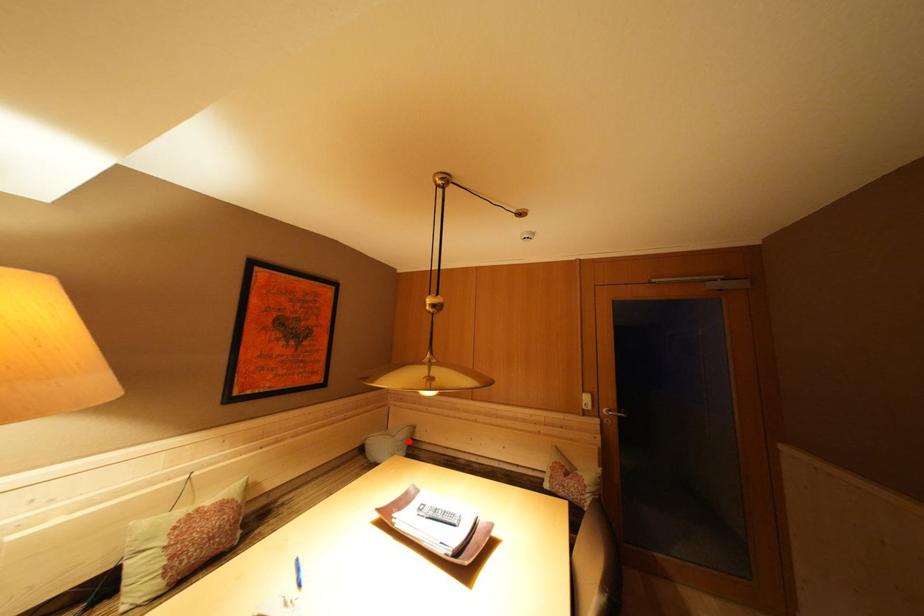
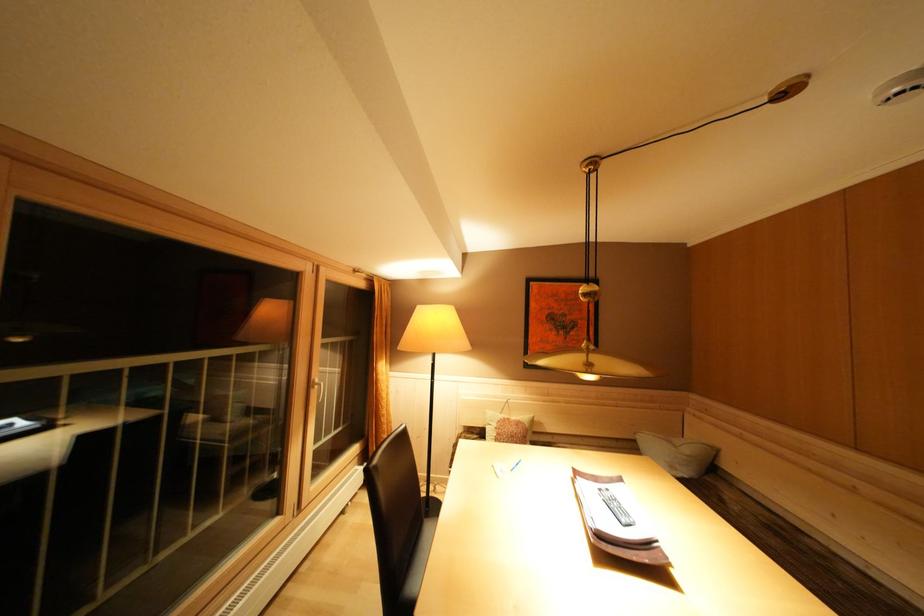
Question: I am providing you with two images of the same scene from different viewpoints. In image1, a red point is highlighted. Considering the same 3D point in image2, which of the following is correct?

Choices:
 (A) It is closer
 (B) It is farther

Answer: (A)